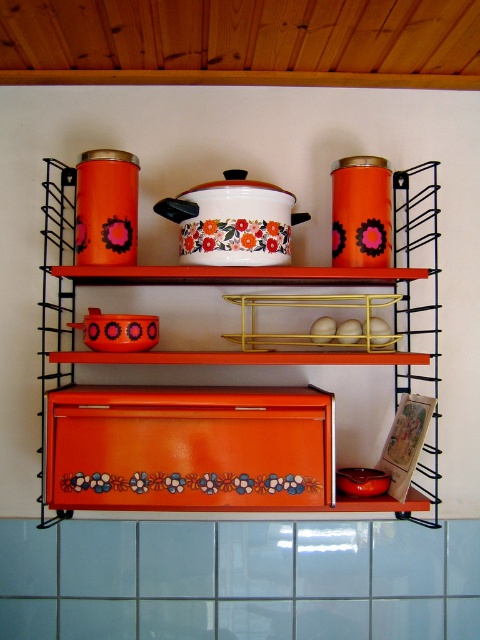
Question: Which point is farther to the camera?

Choices:
 (A) floral enamel pot at center
 (B) orange glossy canister at upper center

Answer: (A)

Question: From the image, what is the correct spatial relationship of orange glossy canister at upper center in relation to floral enamel pot at center?

Choices:
 (A) right
 (B) left

Answer: (A)

Question: Is orange glossy canister at upper center positioned at the back of floral enamel pot at center?

Choices:
 (A) yes
 (B) no

Answer: (B)

Question: Does orange glossy canister at upper center appear on the right side of floral enamel pot at center?

Choices:
 (A) no
 (B) yes

Answer: (B)